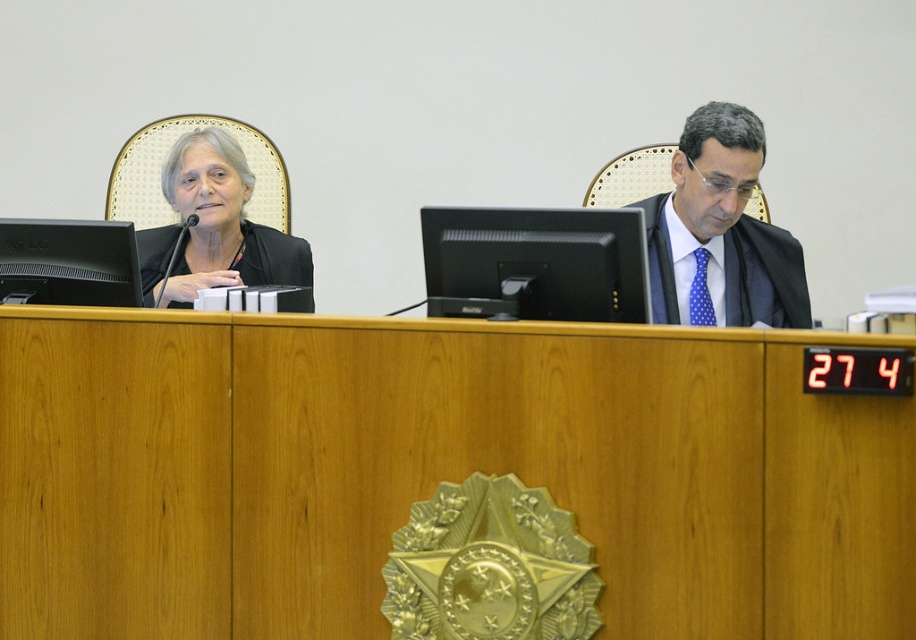
You are an assistant in the courtroom. You need to place a document on the desk between the black matte monitor at left and the black matte business suit at left. Which object should you move to make space?

The black matte monitor at left is shorter than the black matte business suit at left, so you should move the black matte business suit at left to make space since it is taller and might be easier to move out of the way.

You are an assistant who needs to determine if the polka dot tie at center is blocking the view of the black matte monitor at left. Based on the scene description, can you confirm if the tie is covering the monitor?

The polka dot tie at center is positioned over the black matte monitor at left, so yes, the tie is blocking the monitor.

You are an assistant who needs to place a document on the desk between the wooden table at center and the black matte monitor at left. According to the scene description, which object should the document be placed closer to?

The wooden table at center is positioned on the right side of the black matte monitor at left, so the document should be placed closer to the wooden table at center to be between them.